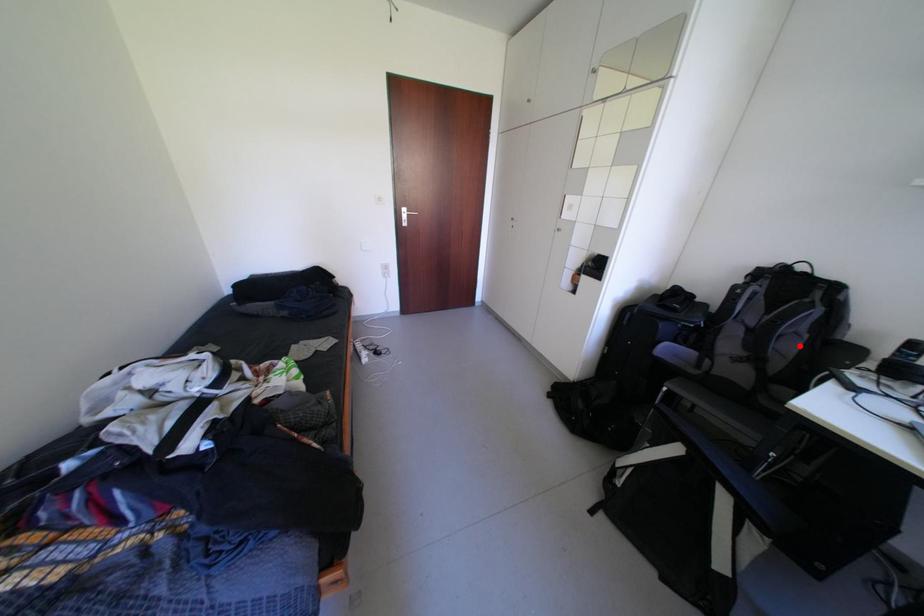
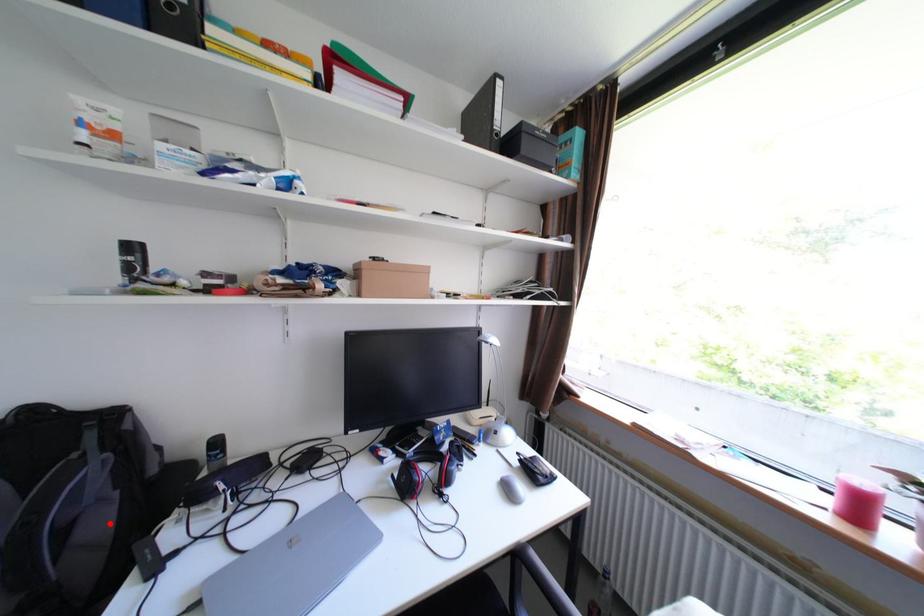
I am providing you with two images of the same scene from different viewpoints. A red point is marked on the first image and another point is marked on the second image. Are the points marked in image1 and image2 representing the same 3D position?

Yes